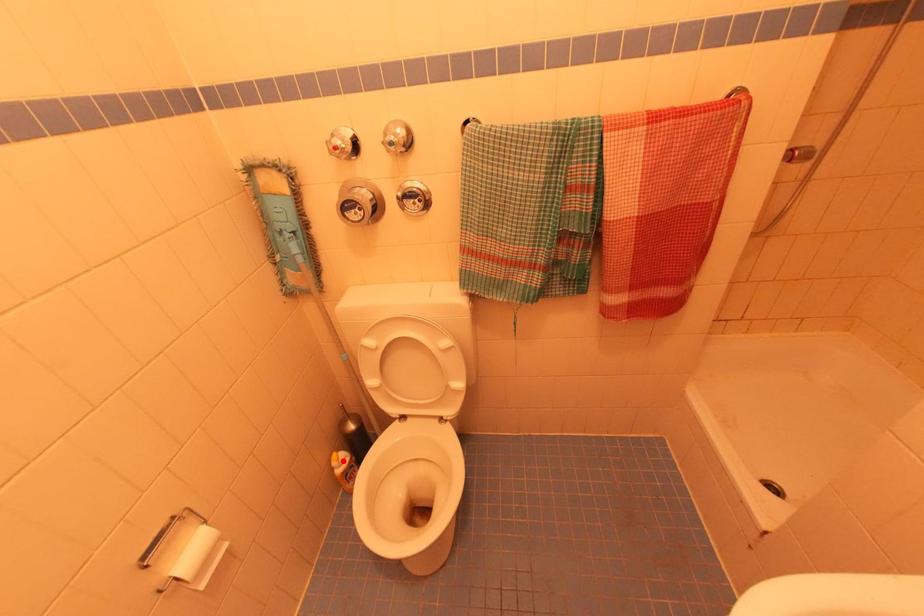
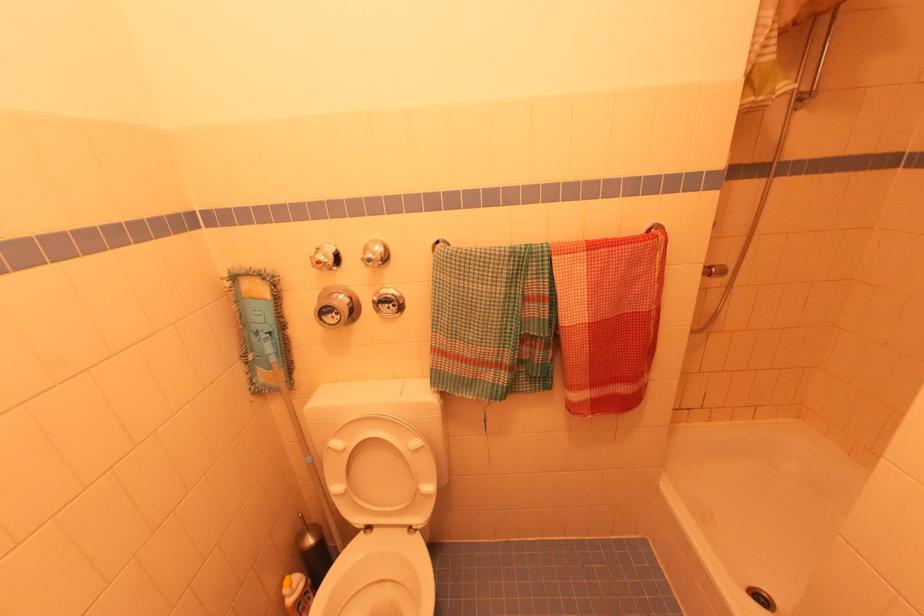
In the second image, find the point that corresponds to the highlighted location in the first image.

(296, 585)